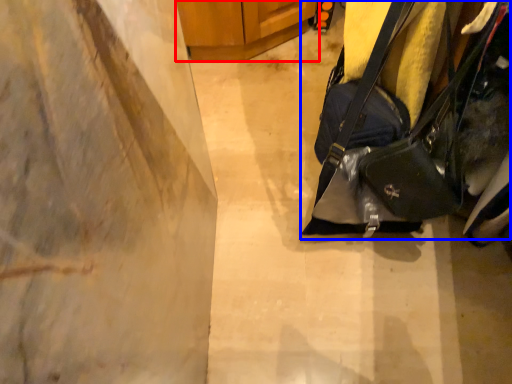
Question: Which of the following is the farthest to the observer, furniture (highlighted by a red box) or handbag (highlighted by a blue box)?

Choices:
 (A) furniture
 (B) handbag

Answer: (A)